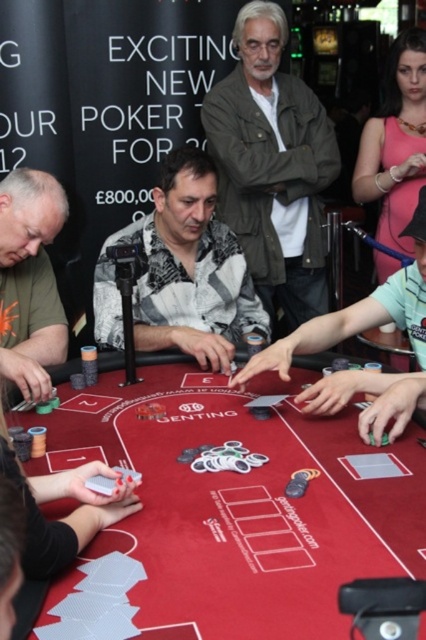
At what (x,y) coordinates should I click in order to perform the action: click on printed cotton shirt at center. Please return your answer as a coordinate pair (x, y). Looking at the image, I should click on (181, 273).

Can you confirm if printed cotton shirt at center is wider than matte black shirt at center?

Indeed, printed cotton shirt at center has a greater width compared to matte black shirt at center.

Is point (226, 246) closer to viewer compared to point (339, 323)?

No, (226, 246) is behind (339, 323).

Where is `printed cotton shirt at center`? This screenshot has width=426, height=640. printed cotton shirt at center is located at coordinates (181, 273).

What do you see at coordinates (356, 333) in the screenshot? I see `matte black shirt at center` at bounding box center [356, 333].

Is matte black shirt at center positioned in front of matte green t-shirt at left?

Yes, it is in front of matte green t-shirt at left.

Measure the distance between matte black shirt at center and camera.

matte black shirt at center and camera are 4.94 feet apart.

Find the location of a particular element. This screenshot has height=640, width=426. matte black shirt at center is located at coordinates (356, 333).

Can you confirm if grayish-green textured jacket at upper center is thinner than matte green t-shirt at left?

No.

Is grayish-green textured jacket at upper center behind matte green t-shirt at left?

Yes, grayish-green textured jacket at upper center is further from the viewer.

Does point (284, 170) come closer to viewer compared to point (23, 296)?

That is False.

Locate an element on the screen. The width and height of the screenshot is (426, 640). grayish-green textured jacket at upper center is located at coordinates (273, 164).